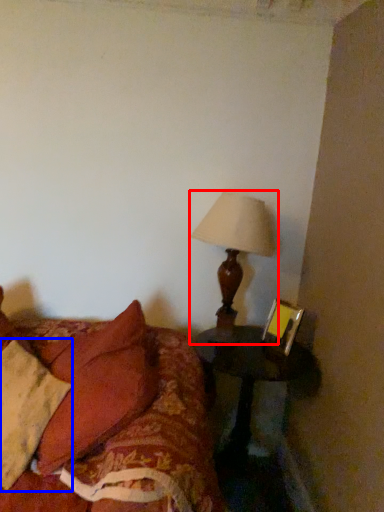
Question: Among these objects, which one is nearest to the camera, lamp (highlighted by a red box) or pillow (highlighted by a blue box)?

Choices:
 (A) lamp
 (B) pillow

Answer: (B)